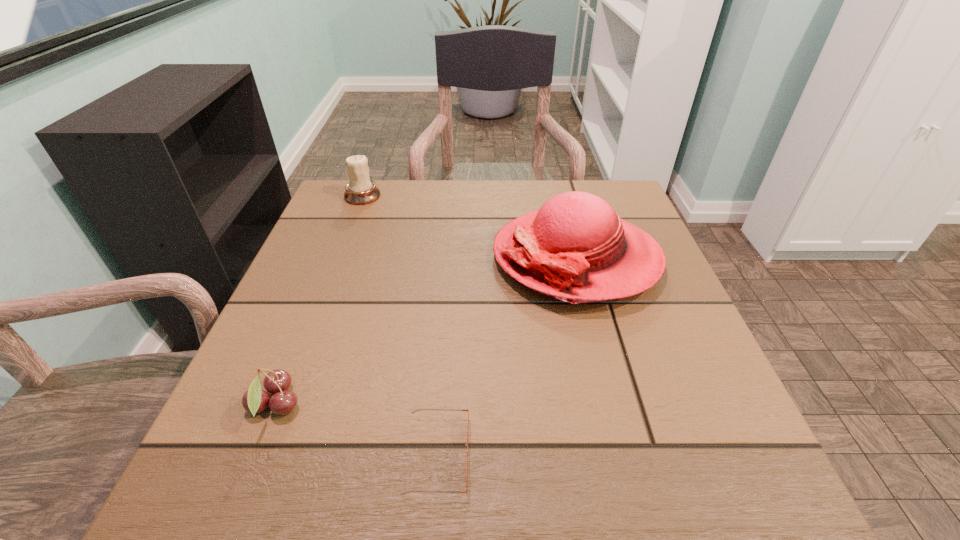
Locate an element on the screen. Image resolution: width=960 pixels, height=540 pixels. free space between the third shortest object and the hat is located at coordinates (469, 226).

Where is `vacant area that lies between the second shortest object and the rightmost object`? Image resolution: width=960 pixels, height=540 pixels. vacant area that lies between the second shortest object and the rightmost object is located at coordinates tap(425, 331).

Where is `blank region between the tallest object and the farthest object`? The image size is (960, 540). blank region between the tallest object and the farthest object is located at coordinates (469, 226).

Locate an element on the screen. This screenshot has height=540, width=960. free space between the farthest object and the shortest object is located at coordinates (400, 325).

The image size is (960, 540). What are the coordinates of `free space between the shortest object and the second tallest object` in the screenshot? It's located at tap(400, 325).

Locate an element on the screen. free space between the tallest object and the second shortest object is located at coordinates (425, 331).

This screenshot has height=540, width=960. In order to click on vacant area that lies between the third nearest object and the cherry in this screenshot , I will do click(425, 331).

This screenshot has width=960, height=540. Find the location of `the closest object to the shortest object`. the closest object to the shortest object is located at coordinates (255, 400).

This screenshot has width=960, height=540. What are the coordinates of `object that is the third closest to the hat` in the screenshot? It's located at (255, 400).